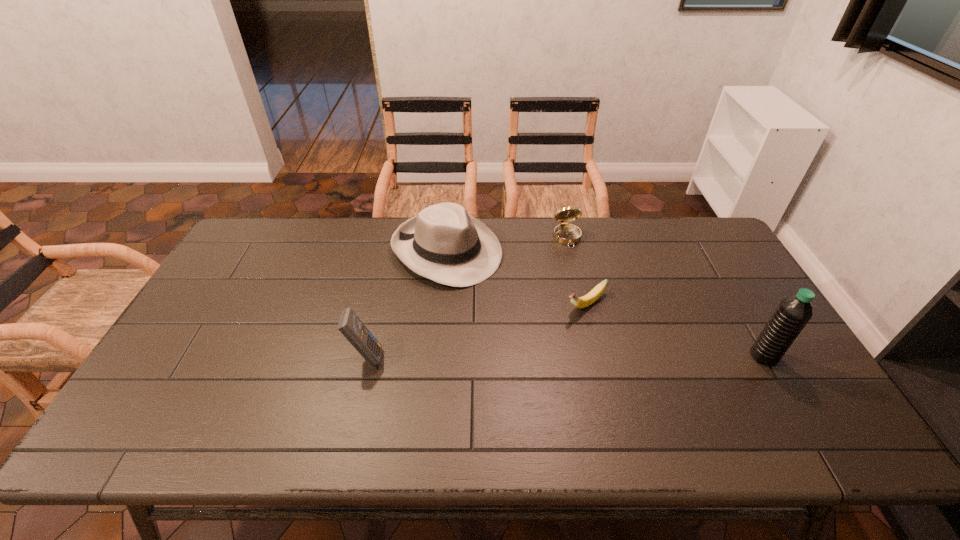
This screenshot has width=960, height=540. In order to click on object that is at the right edge in this screenshot , I will do [x=793, y=313].

In the image, there is a desktop. Where is `vacant space at the far edge`? vacant space at the far edge is located at coordinates (512, 220).

I want to click on vacant space at the near edge, so click(x=684, y=409).

Locate an element on the screen. The width and height of the screenshot is (960, 540). vacant space at the left edge of the desktop is located at coordinates pyautogui.click(x=220, y=287).

At what (x,y) coordinates should I click in order to perform the action: click on free spot at the right edge of the desktop. Please return your answer as a coordinate pair (x, y). Image resolution: width=960 pixels, height=540 pixels. Looking at the image, I should click on (716, 326).

The image size is (960, 540). Find the location of `vacant space at the near left corner of the desktop`. vacant space at the near left corner of the desktop is located at coordinates (175, 390).

This screenshot has height=540, width=960. Identify the location of free space that is in between the second shortest object and the rightmost object. [665, 297].

You are a GUI agent. You are given a task and a screenshot of the screen. Output one action in this format:
    pyautogui.click(x=<x>, y=<y>)
    Task: Click on the vacant space that is in between the water bottle and the fedora
    The height and width of the screenshot is (540, 960).
    Given the screenshot: What is the action you would take?
    pyautogui.click(x=605, y=303)

At what (x,y) coordinates should I click in order to perform the action: click on free space between the third nearest object and the calculator. Please return your answer as a coordinate pair (x, y). Image resolution: width=960 pixels, height=540 pixels. Looking at the image, I should click on (476, 330).

Image resolution: width=960 pixels, height=540 pixels. Find the location of `vacant area that lies between the banana and the water bottle`. vacant area that lies between the banana and the water bottle is located at coordinates (675, 330).